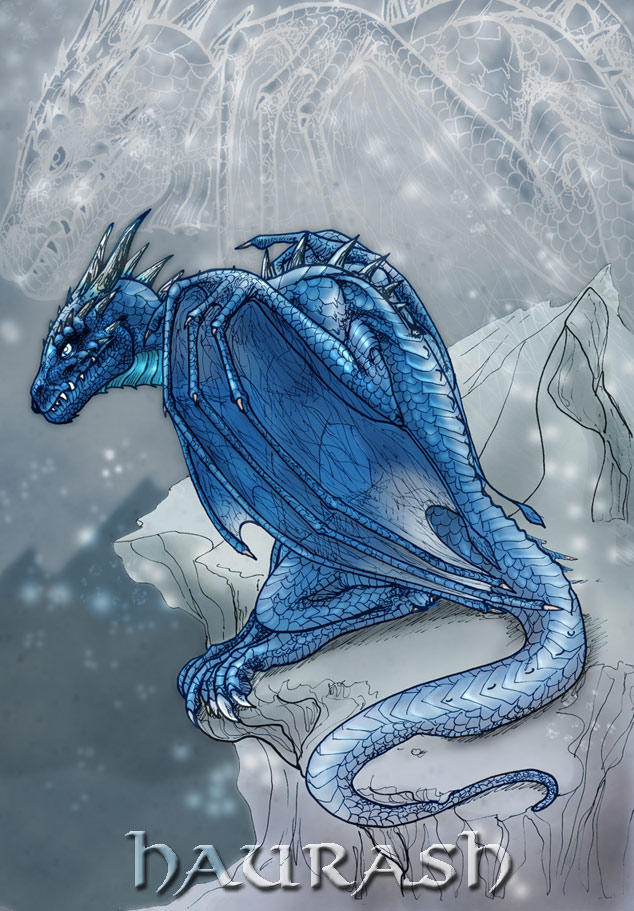
Locate an element on the screen. The image size is (634, 911). artwork is located at coordinates (302, 474).